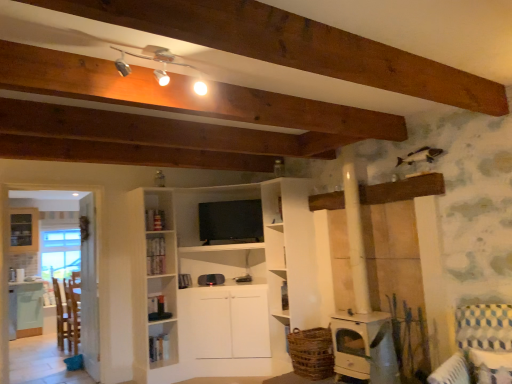
The width and height of the screenshot is (512, 384). Describe the element at coordinates (159, 69) in the screenshot. I see `silver metallic track lights at upper center` at that location.

This screenshot has height=384, width=512. Identify the location of wooden chair at left. (67, 317).

What do you see at coordinates (89, 288) in the screenshot?
I see `transparent glass door at left` at bounding box center [89, 288].

The width and height of the screenshot is (512, 384). I want to click on silver metallic track lights at upper center, so click(x=159, y=69).

Based on their sizes in the image, would you say green matte table at lower left is bigger or smaller than white matte wood stove at lower center?

Considering their sizes, green matte table at lower left takes up more space than white matte wood stove at lower center.

Considering the relative sizes of green matte table at lower left and white matte wood stove at lower center in the image provided, is green matte table at lower left taller than white matte wood stove at lower center?

Yes.

Which point is more distant from viewer, (x=17, y=316) or (x=358, y=374)?

Positioned behind is point (x=17, y=316).

Is white matte wood stove at lower center at the back of green matte table at lower left?

green matte table at lower left is not turned away from white matte wood stove at lower center.

Is there a large distance between wooden chair at left and transparent glass door at left?

No, wooden chair at left is not far from transparent glass door at left.

How much distance is there between wooden chair at left and transparent glass door at left?

A distance of 34.63 inches exists between wooden chair at left and transparent glass door at left.

Is wooden chair at left taller or shorter than transparent glass door at left?

In the image, wooden chair at left appears to be shorter than transparent glass door at left.

From a real-world perspective, which object rests below the other?

wooden chair at left, from a real-world perspective.

Locate an element on the screen. The image size is (512, 384). chair above the white matte wood stove at lower center (from a real-world perspective) is located at coordinates (67, 317).

Can you confirm if white matte wood stove at lower center is positioned to the right of wooden chair at left?

Yes, white matte wood stove at lower center is to the right of wooden chair at left.

From the image's perspective, is white matte wood stove at lower center under wooden chair at left?

No, from the image's perspective, white matte wood stove at lower center is not beneath wooden chair at left.

From the picture: Is transparent glass door at left facing towards wooden chair at left?

No, transparent glass door at left is not turned towards wooden chair at left.

What's the angular difference between transparent glass door at left and wooden chair at left's facing directions?

179 degrees.

Does point (93, 291) come farther from viewer compared to point (67, 300)?

No, it is not.

Does transparent glass door at left contain wooden chair at left?

No, wooden chair at left is located outside of transparent glass door at left.

How different are the orientations of silver metallic track lights at upper center and white matte wood stove at lower center in degrees?

silver metallic track lights at upper center and white matte wood stove at lower center are facing 90.4 degrees away from each other.

Which object is wider, silver metallic track lights at upper center or white matte wood stove at lower center?

Wider between the two is white matte wood stove at lower center.

From the picture: Is silver metallic track lights at upper center surrounding white matte wood stove at lower center?

No, white matte wood stove at lower center is not a part of silver metallic track lights at upper center.

Identify the location of appliance behind the silver metallic track lights at upper center. This screenshot has width=512, height=384. (364, 347).

Which object is closer to the camera taking this photo, silver metallic track lights at upper center or transparent glass door at left?

silver metallic track lights at upper center.

From a real-world perspective, between silver metallic track lights at upper center and transparent glass door at left, who is vertically lower?

transparent glass door at left, from a real-world perspective.

Can you tell me how much silver metallic track lights at upper center and transparent glass door at left differ in facing direction?

There is a 86.9-degree angle between the facing directions of silver metallic track lights at upper center and transparent glass door at left.

Which object is wider, blue and white checkered fabric armchair at lower right or transparent glass door at left?

blue and white checkered fabric armchair at lower right.

From a real-world perspective, is blue and white checkered fabric armchair at lower right positioned over transparent glass door at left based on gravity?

No, from a real-world perspective, blue and white checkered fabric armchair at lower right is not above transparent glass door at left.

Between blue and white checkered fabric armchair at lower right and transparent glass door at left, which one has more height?

Standing taller between the two is transparent glass door at left.

Is transparent glass door at left at the back of blue and white checkered fabric armchair at lower right?

No, transparent glass door at left is not at the back of blue and white checkered fabric armchair at lower right.

Locate an element on the screen. table on the left side of white matte wood stove at lower center is located at coordinates (25, 309).

In order to click on glass door above the wooden chair at left (from the image's perspective) in this screenshot , I will do `click(89, 288)`.

Considering their positions, is green matte table at lower left positioned further to transparent glass door at left than blue and white checkered fabric armchair at lower right?

Among the two, blue and white checkered fabric armchair at lower right is located further to transparent glass door at left.

Based on their spatial positions, is transparent glass door at left or green matte table at lower left further from wooden chair at left?

transparent glass door at left is positioned further to the anchor wooden chair at left.

Which object lies further to the anchor point blue and white checkered fabric armchair at lower right, wooden chair at left or green matte table at lower left?

green matte table at lower left.

Estimate the real-world distances between objects in this image. Which object is closer to white matte wood stove at lower center, wooden chair at left or transparent glass door at left?

Result: Among the two, transparent glass door at left is located nearer to white matte wood stove at lower center.

Looking at this image, from the image, which object appears to be farther from transparent glass door at left, white matte wood stove at lower center or wooden chair at left?

Among the two, white matte wood stove at lower center is located further to transparent glass door at left.

Based on the photo, considering their positions, is silver metallic track lights at upper center positioned further to blue and white checkered fabric armchair at lower right than white matte wood stove at lower center?

silver metallic track lights at upper center lies further to blue and white checkered fabric armchair at lower right than the other object.

From the image, which object appears to be farther from green matte table at lower left, silver metallic track lights at upper center or transparent glass door at left?

silver metallic track lights at upper center is further to green matte table at lower left.

Looking at the image, which one is located further to green matte table at lower left, silver metallic track lights at upper center or blue and white checkered fabric armchair at lower right?

The object further to green matte table at lower left is blue and white checkered fabric armchair at lower right.

This screenshot has width=512, height=384. I want to click on glass door between green matte table at lower left and white matte wood stove at lower center, so click(x=89, y=288).

At what (x,y) coordinates should I click in order to perform the action: click on chair between green matte table at lower left and blue and white checkered fabric armchair at lower right from left to right. Please return your answer as a coordinate pair (x, y). The width and height of the screenshot is (512, 384). Looking at the image, I should click on (67, 317).

The image size is (512, 384). What are the coordinates of `glass door located between green matte table at lower left and blue and white checkered fabric armchair at lower right in the left-right direction` in the screenshot? It's located at coord(89,288).

Locate an element on the screen. The width and height of the screenshot is (512, 384). chair positioned between silver metallic track lights at upper center and green matte table at lower left from near to far is located at coordinates tap(67, 317).